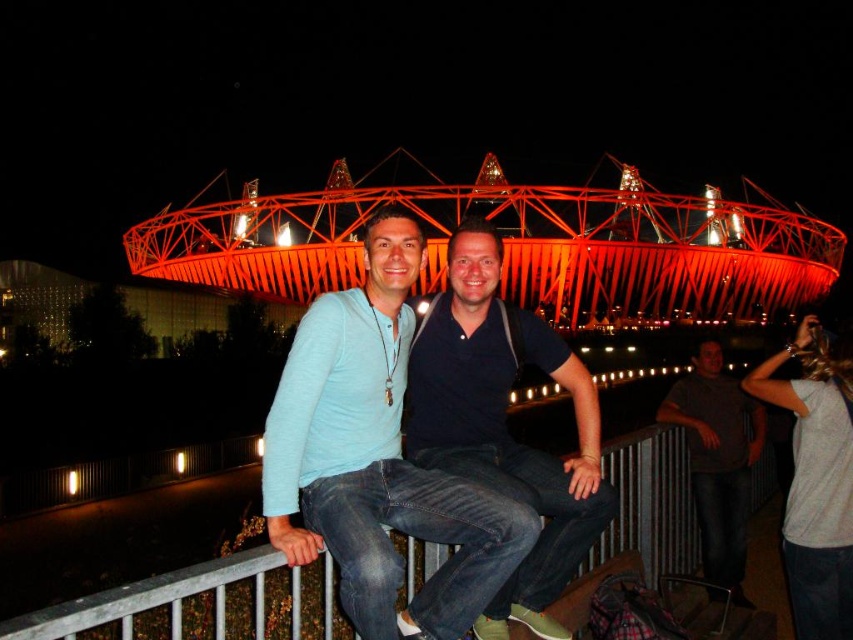
Question: Can you confirm if light blue denim jeans at center is thinner than dark blue shirt at center?

Choices:
 (A) yes
 (B) no

Answer: (B)

Question: Is metallic framework at center to the left of dark gray t-shirt at right from the viewer's perspective?

Choices:
 (A) yes
 (B) no

Answer: (A)

Question: Can you confirm if wooden at center is positioned above white cotton shirt at lower right?

Choices:
 (A) no
 (B) yes

Answer: (A)

Question: Which object appears farthest from the camera in this image?

Choices:
 (A) wooden at center
 (B) light blue denim jeans at center

Answer: (B)

Question: Among these objects, which one is farthest from the camera?

Choices:
 (A) light blue denim jeans at center
 (B) white cotton shirt at lower right

Answer: (B)

Question: Which is nearer to the dark gray t-shirt at right?

Choices:
 (A) metallic framework at center
 (B) white cotton shirt at lower right
 (C) dark blue shirt at center
 (D) wooden at center

Answer: (B)